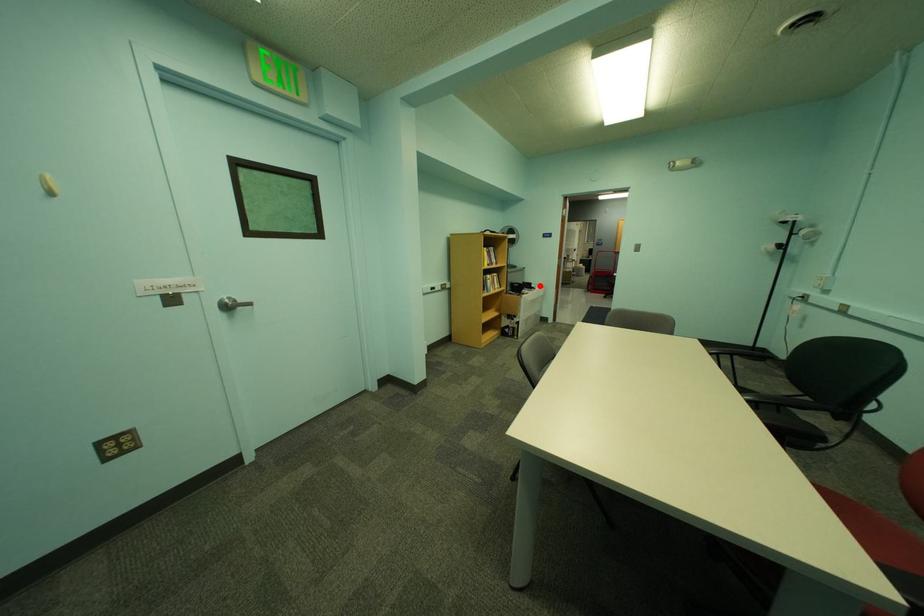
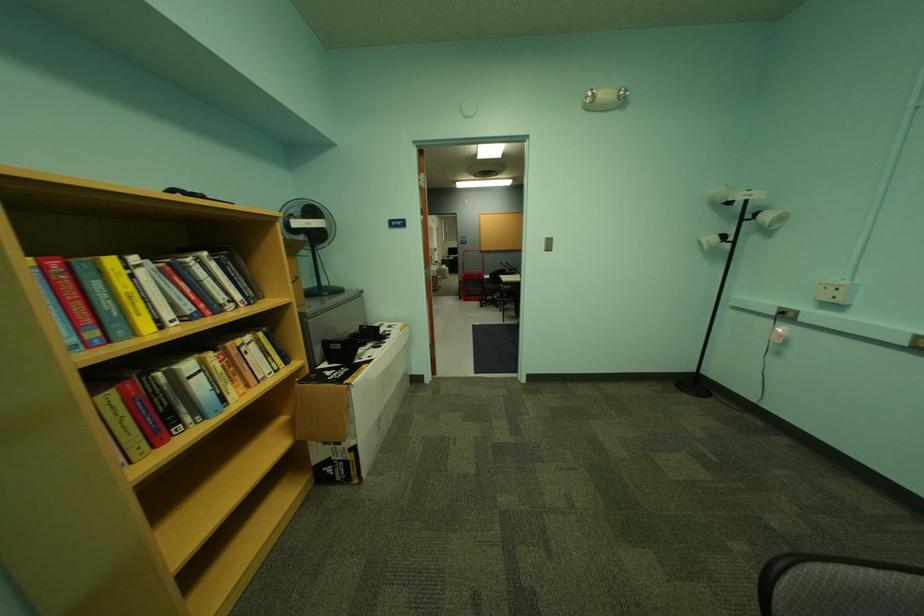
In the second image, find the point that corresponds to the highlighted location in the first image.

(386, 330)